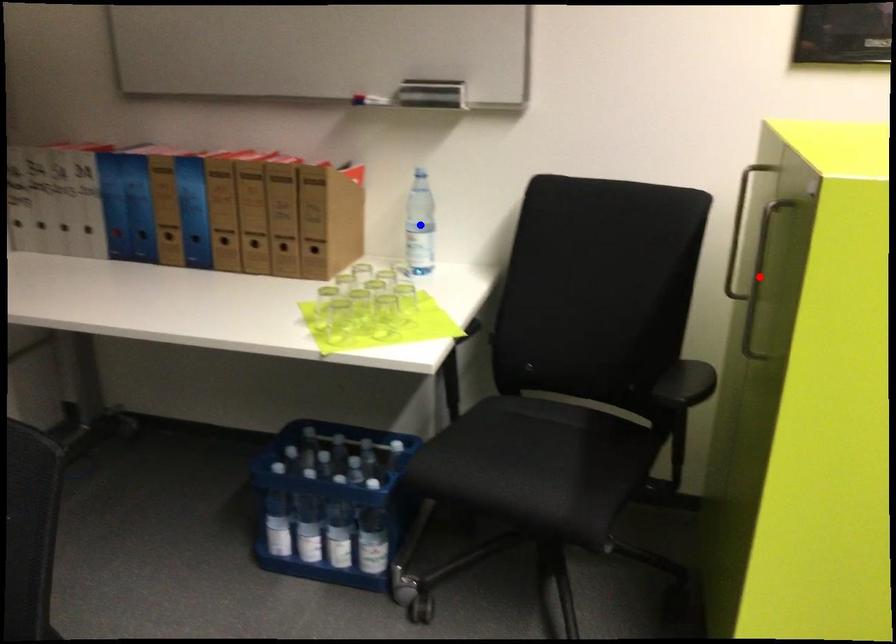
Question: Two points are marked on the image. Which point is closer to the camera?

Choices:
 (A) Blue point is closer.
 (B) Red point is closer.

Answer: (B)